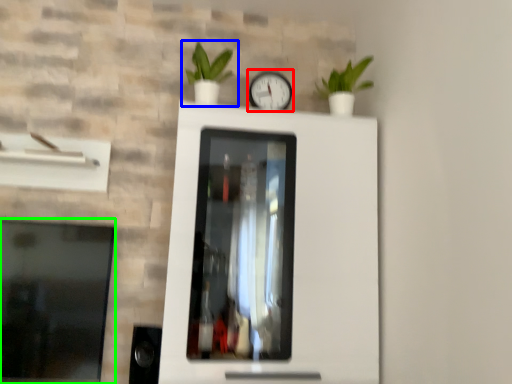
Question: Estimate the real-world distances between objects in this image. Which object is farther from clock (highlighted by a red box), houseplant (highlighted by a blue box) or window (highlighted by a green box)?

Choices:
 (A) houseplant
 (B) window

Answer: (B)